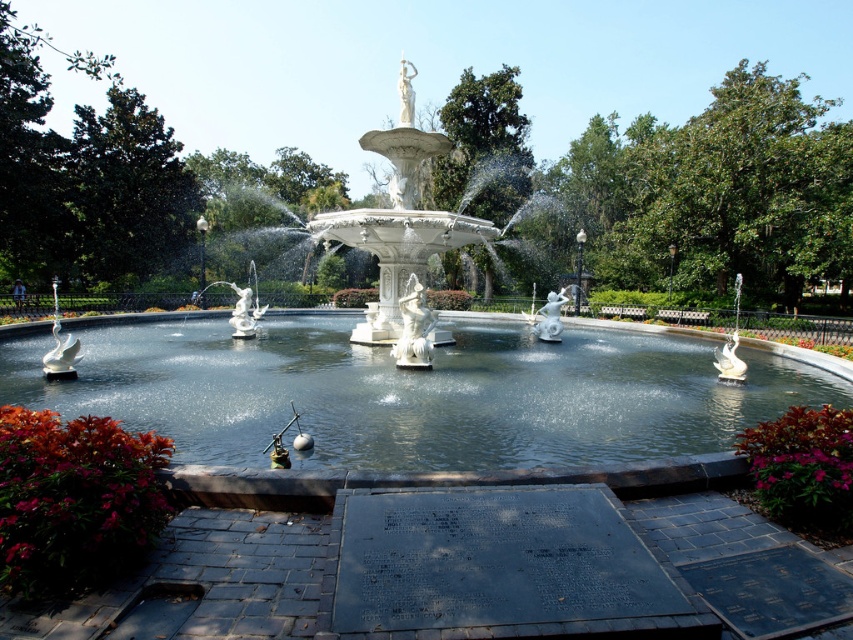
Question: Among these points, which one is farthest from the camera?

Choices:
 (A) (51, 500)
 (B) (851, 433)

Answer: (B)

Question: Which point is closer to the camera?

Choices:
 (A) (136, 536)
 (B) (822, 452)

Answer: (A)

Question: Considering the real-world distances, which object is closest to the white marble fountain at center?

Choices:
 (A) green leafy plant at lower left
 (B) green leafy plant at lower right

Answer: (A)

Question: Is white marble fountain at center thinner than green leafy plant at lower right?

Choices:
 (A) no
 (B) yes

Answer: (A)

Question: Is white marble fountain at center wider than green leafy plant at lower right?

Choices:
 (A) no
 (B) yes

Answer: (B)

Question: Is green leafy plant at lower left to the right of green leafy plant at lower right from the viewer's perspective?

Choices:
 (A) yes
 (B) no

Answer: (B)